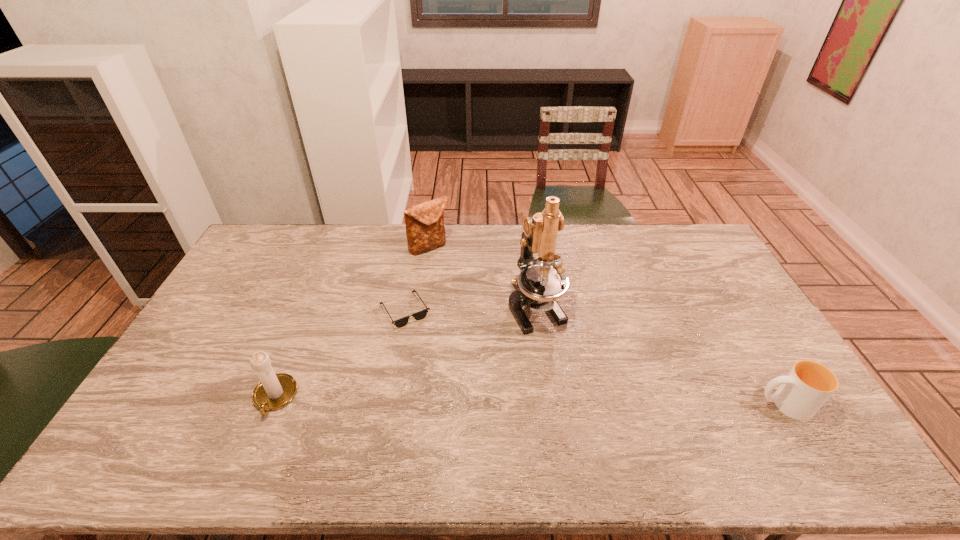
This screenshot has height=540, width=960. In order to click on vacant space on the desktop that is between the leftmost object and the cup and is positioned at the eyepiece of the microscope in this screenshot , I will do `click(596, 402)`.

Identify the location of vacant space on the desktop that is between the candle holder and the fourth tallest object and is positioned on the open side of the farthest object. click(x=549, y=401).

This screenshot has height=540, width=960. I want to click on vacant spot on the desktop that is between the leftmost object and the rightmost object and is positioned on the lenses of the sunglasses, so 583,402.